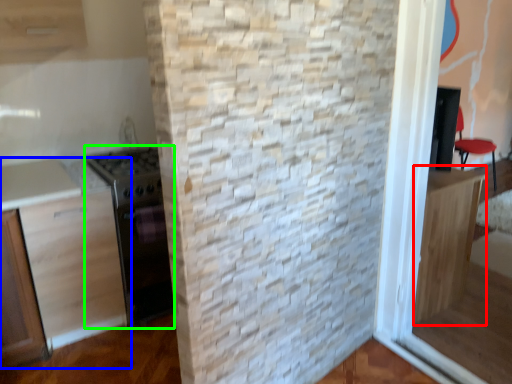
Question: Considering the real-world distances, which object is farthest from cabinetry (highlighted by a red box)? cabinetry (highlighted by a blue box) or appliance (highlighted by a green box)?

Choices:
 (A) cabinetry
 (B) appliance

Answer: (A)